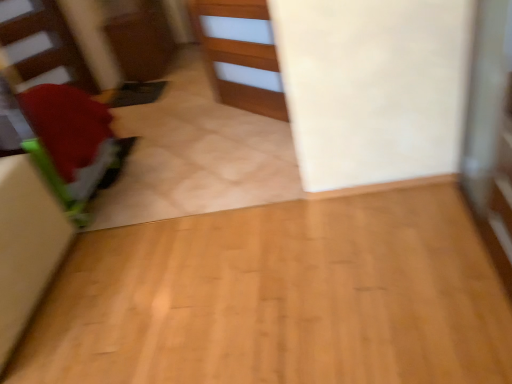
Find the location of a particular element. This screenshot has width=512, height=384. free region on the left part of wooden cabinet at center is located at coordinates (178, 144).